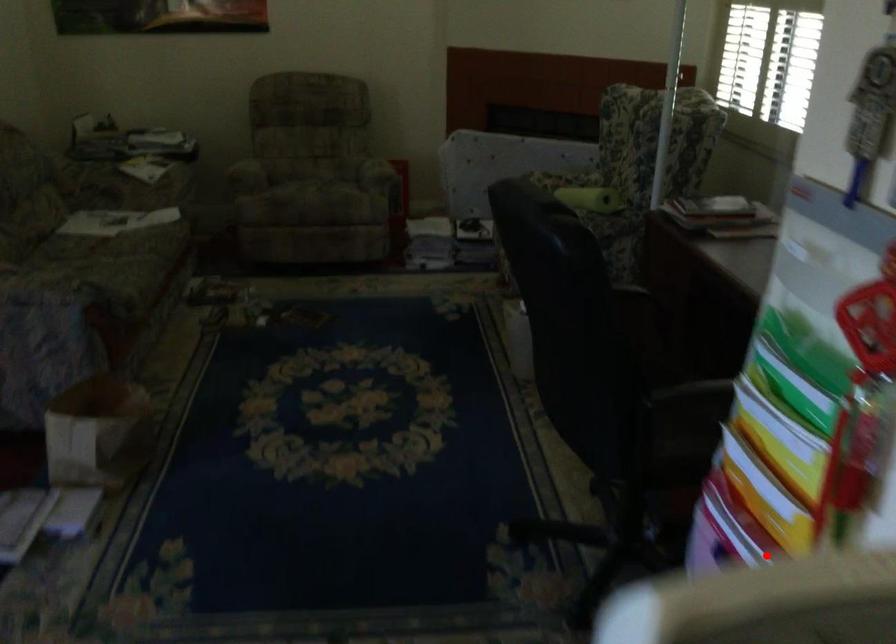
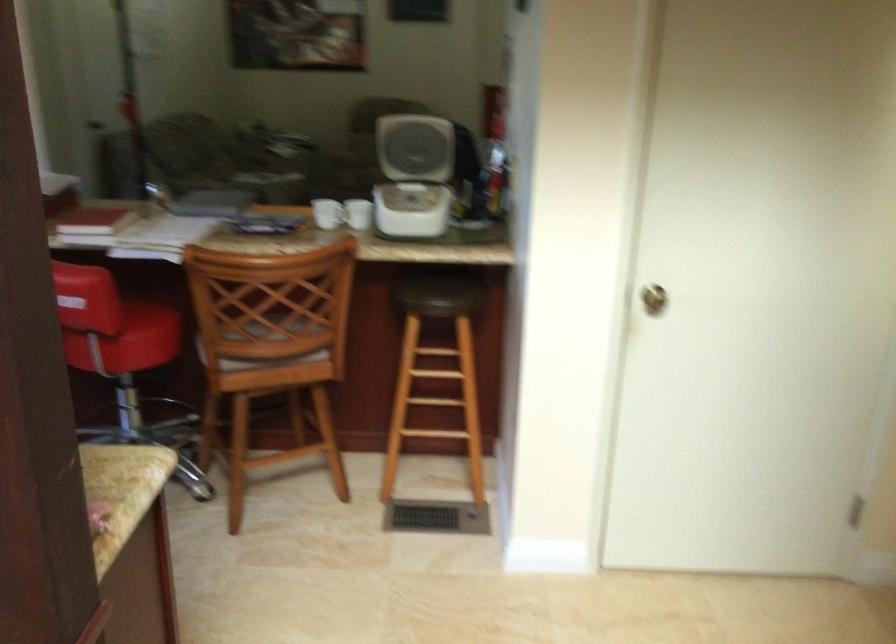
Question: I am providing you with two images of the same scene from different viewpoints. A red point is shown in image1. For the corresponding object point in image2, is it positioned nearer or farther from the camera?

Choices:
 (A) Nearer
 (B) Farther

Answer: (B)